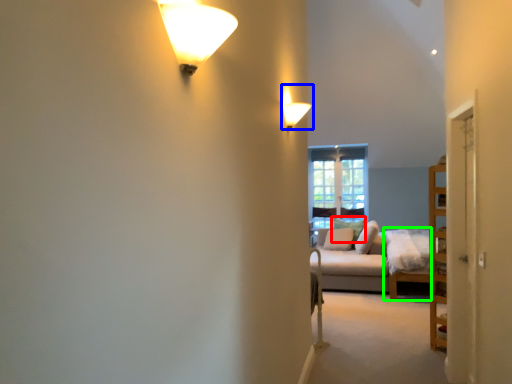
Question: Which object is the closest to the pillow (highlighted by a red box)? Choose among these: lamp (highlighted by a blue box) or couch (highlighted by a green box).

Choices:
 (A) lamp
 (B) couch

Answer: (B)